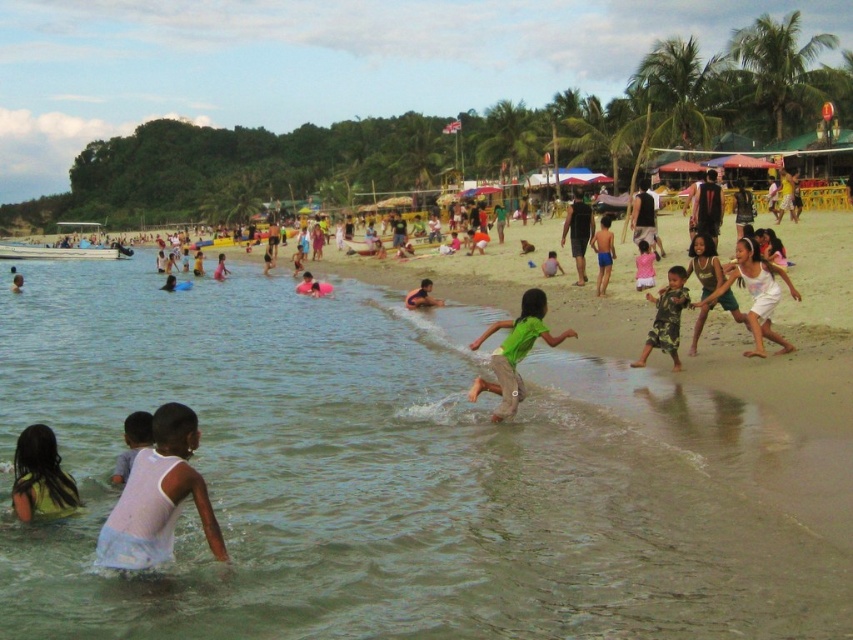
Question: Is green matte shirt at center closer to camera compared to camouflage shorts at lower right?

Choices:
 (A) yes
 (B) no

Answer: (A)

Question: Can you confirm if clear water at beach center is positioned to the left of green matte shirt at center?

Choices:
 (A) yes
 (B) no

Answer: (A)

Question: Is white cotton dress at center below pink fabric dress at center?

Choices:
 (A) yes
 (B) no

Answer: (A)

Question: Which object appears farthest from the camera in this image?

Choices:
 (A) blue swim trunks at center
 (B) black cotton shorts at center
 (C) pink fabric dress at center

Answer: (B)

Question: Which point is farther from the camera taking this photo?

Choices:
 (A) (163, 525)
 (B) (527, 381)
 (C) (599, 280)

Answer: (C)

Question: Which point is farther from the camera taking this photo?

Choices:
 (A) (471, 348)
 (B) (426, 298)
 (C) (578, 193)

Answer: (C)